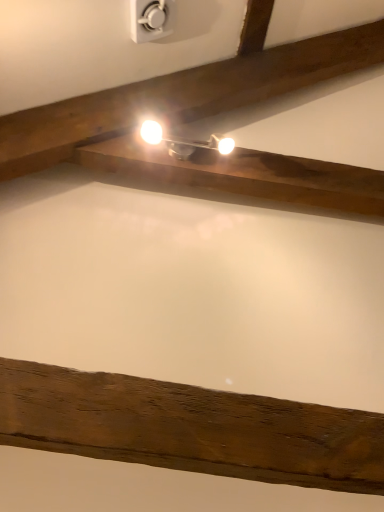
In order to click on white plastic power plugs and sockets at upper center in this screenshot , I will do `click(151, 19)`.

What do you see at coordinates (151, 19) in the screenshot? I see `white plastic power plugs and sockets at upper center` at bounding box center [151, 19].

The width and height of the screenshot is (384, 512). In order to click on white glossy light fixture at upper center in this screenshot , I will do `click(184, 141)`.

Describe the element at coordinates (184, 141) in the screenshot. I see `white glossy light fixture at upper center` at that location.

Where is `white plastic power plugs and sockets at upper center`? white plastic power plugs and sockets at upper center is located at coordinates (151, 19).

Which object is positioned more to the left, white plastic power plugs and sockets at upper center or white glossy light fixture at upper center?

Positioned to the left is white plastic power plugs and sockets at upper center.

Between white plastic power plugs and sockets at upper center and white glossy light fixture at upper center, which one is positioned behind?

white glossy light fixture at upper center is further away from the camera.

Considering the positions of points (148, 29) and (144, 131), is point (148, 29) farther from camera compared to point (144, 131)?

No, it is in front of (144, 131).

From the image's perspective, is white plastic power plugs and sockets at upper center beneath white glossy light fixture at upper center?

Actually, white plastic power plugs and sockets at upper center appears above white glossy light fixture at upper center in the image.

From a real-world perspective, is white plastic power plugs and sockets at upper center on white glossy light fixture at upper center?

Yes, from a real-world perspective, white plastic power plugs and sockets at upper center is over white glossy light fixture at upper center

Consider the image. Considering the sizes of objects white plastic power plugs and sockets at upper center and white glossy light fixture at upper center in the image provided, who is wider, white plastic power plugs and sockets at upper center or white glossy light fixture at upper center?

white glossy light fixture at upper center.

Is white plastic power plugs and sockets at upper center taller than white glossy light fixture at upper center?

Yes.

Which of these two, white plastic power plugs and sockets at upper center or white glossy light fixture at upper center, is bigger?

With larger size is white plastic power plugs and sockets at upper center.

Is white plastic power plugs and sockets at upper center not inside white glossy light fixture at upper center?

Yes, white plastic power plugs and sockets at upper center is not within white glossy light fixture at upper center.

Is white plastic power plugs and sockets at upper center next to white glossy light fixture at upper center?

No, white plastic power plugs and sockets at upper center is not beside white glossy light fixture at upper center.

Is white plastic power plugs and sockets at upper center looking in the opposite direction of white glossy light fixture at upper center?

No.

Find the location of a particular element. The image size is (384, 512). power plugs and sockets lying above the white glossy light fixture at upper center (from the image's perspective) is located at coordinates (151, 19).

Can you confirm if white glossy light fixture at upper center is positioned to the left of white plastic power plugs and sockets at upper center?

Incorrect, white glossy light fixture at upper center is not on the left side of white plastic power plugs and sockets at upper center.

Which object is closer to the camera taking this photo, white glossy light fixture at upper center or white plastic power plugs and sockets at upper center?

white plastic power plugs and sockets at upper center is closer to the camera.

Does point (144, 137) lie in front of point (173, 25)?

That is True.

From the image's perspective, is white glossy light fixture at upper center over white plastic power plugs and sockets at upper center?

Actually, white glossy light fixture at upper center appears below white plastic power plugs and sockets at upper center in the image.

From a real-world perspective, between white glossy light fixture at upper center and white plastic power plugs and sockets at upper center, who is vertically lower?

white glossy light fixture at upper center.

Between white glossy light fixture at upper center and white plastic power plugs and sockets at upper center, which one has smaller width?

white plastic power plugs and sockets at upper center.

Between white glossy light fixture at upper center and white plastic power plugs and sockets at upper center, which one has more height?

white plastic power plugs and sockets at upper center.

Who is bigger, white glossy light fixture at upper center or white plastic power plugs and sockets at upper center?

white plastic power plugs and sockets at upper center is bigger.

Is white glossy light fixture at upper center surrounding white plastic power plugs and sockets at upper center?

No, white glossy light fixture at upper center does not contain white plastic power plugs and sockets at upper center.

Would you say white glossy light fixture at upper center is a long distance from white plastic power plugs and sockets at upper center?

They are positioned close to each other.

Could you tell me if white glossy light fixture at upper center is turned towards white plastic power plugs and sockets at upper center?

No, white glossy light fixture at upper center does not turn towards white plastic power plugs and sockets at upper center.

How many degrees apart are the facing directions of white glossy light fixture at upper center and white plastic power plugs and sockets at upper center?

There is a 90-degree angle between the facing directions of white glossy light fixture at upper center and white plastic power plugs and sockets at upper center.

How far apart are white glossy light fixture at upper center and white plastic power plugs and sockets at upper center?

A distance of 14.19 inches exists between white glossy light fixture at upper center and white plastic power plugs and sockets at upper center.

Where is `light fixture behind the white plastic power plugs and sockets at upper center`? The height and width of the screenshot is (512, 384). light fixture behind the white plastic power plugs and sockets at upper center is located at coordinates (184, 141).

Image resolution: width=384 pixels, height=512 pixels. I want to click on power plugs and sockets located above the white glossy light fixture at upper center (from a real-world perspective), so click(151, 19).

At what (x,y) coordinates should I click in order to perform the action: click on light fixture that is behind the white plastic power plugs and sockets at upper center. Please return your answer as a coordinate pair (x, y). Looking at the image, I should click on (184, 141).